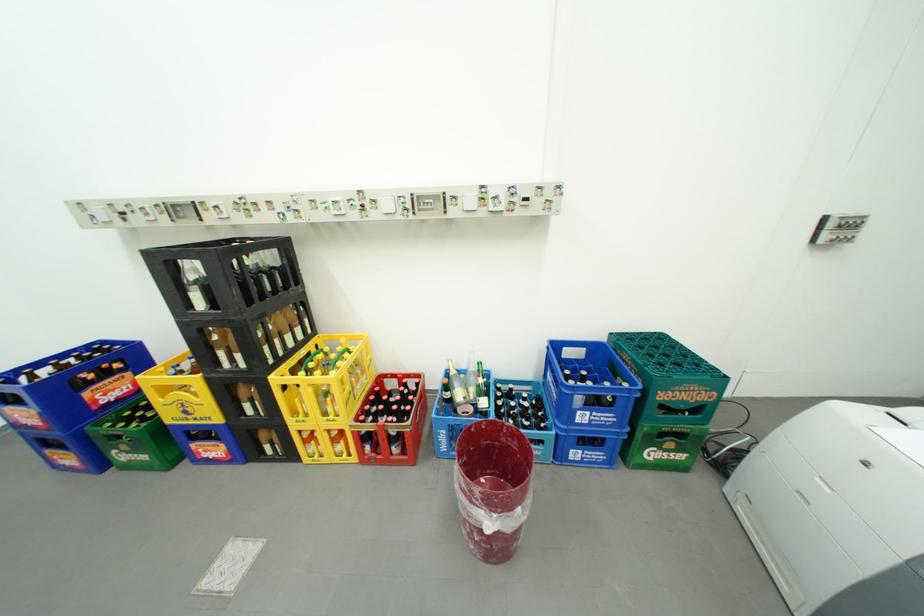
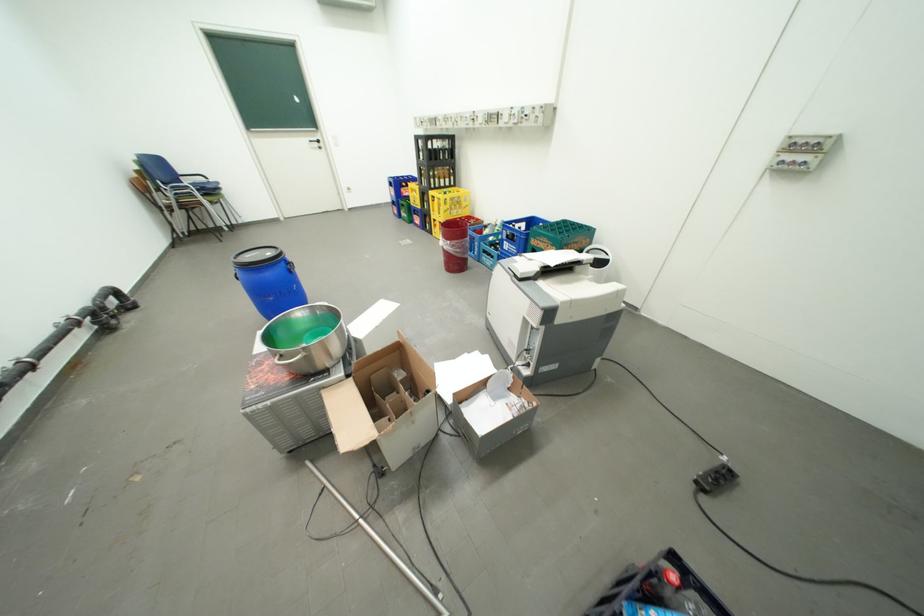
Where in the second image is the point corresponding to the point at 614,424 from the first image?

(523, 253)